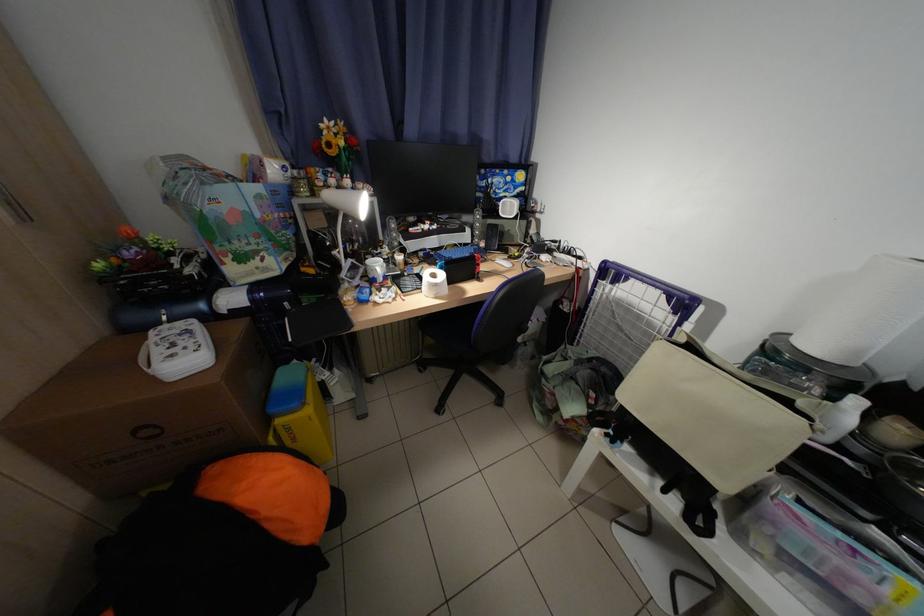
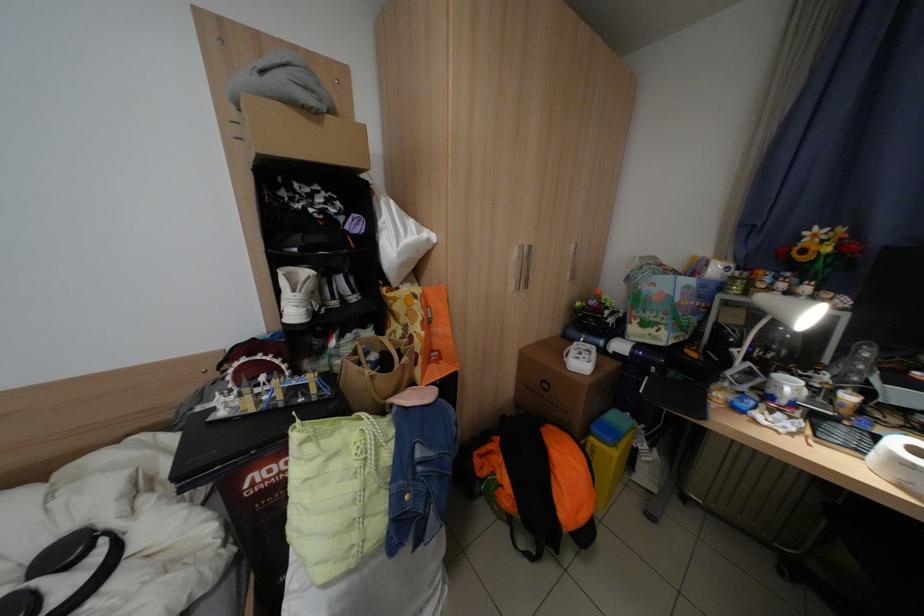
The point at [284,411] is marked in the first image. Where is the corresponding point in the second image?

(604, 430)